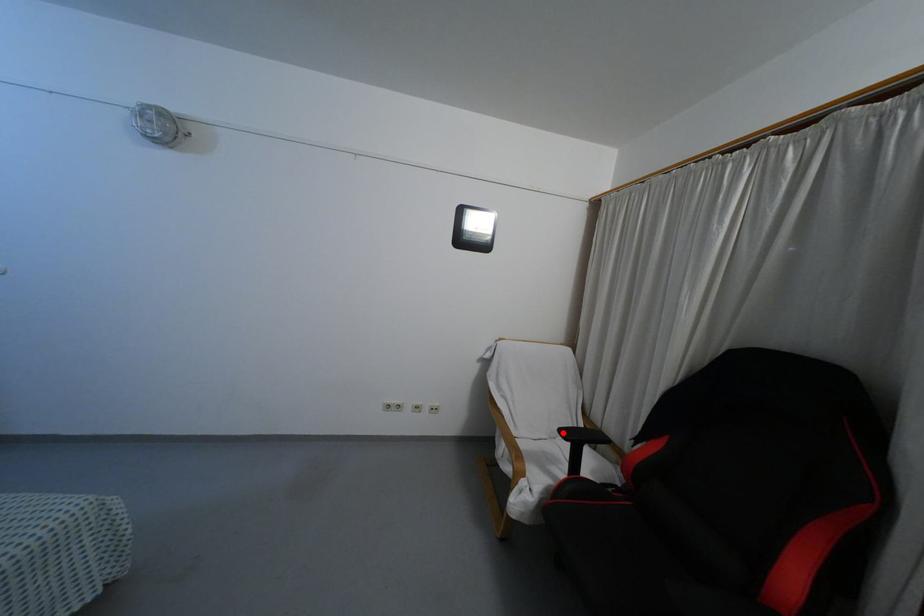
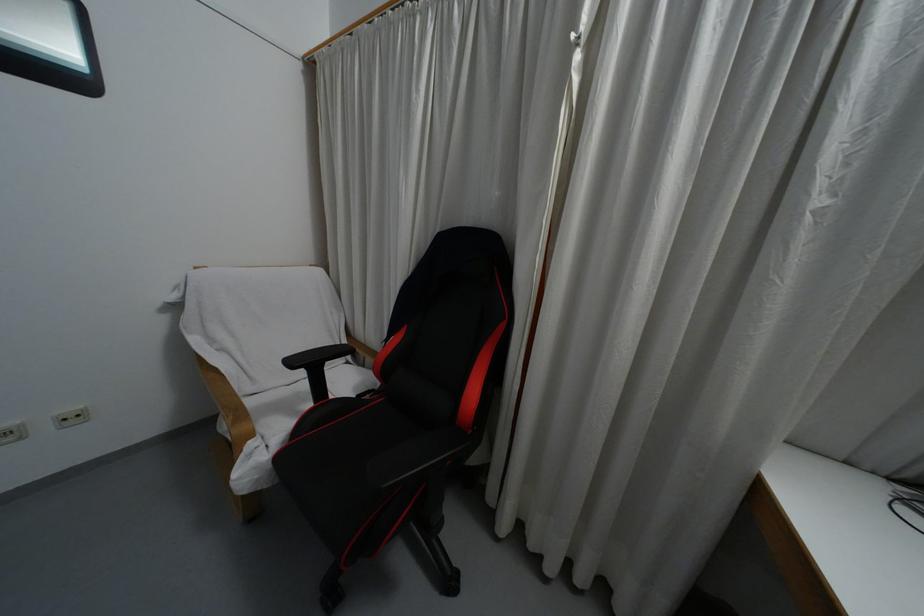
Question: I am providing you with two images of the same scene from different viewpoints. Given a red point in image1, look at the same physical point in image2. Is it:

Choices:
 (A) Closer to the viewpoint
 (B) Farther from the viewpoint

Answer: (B)